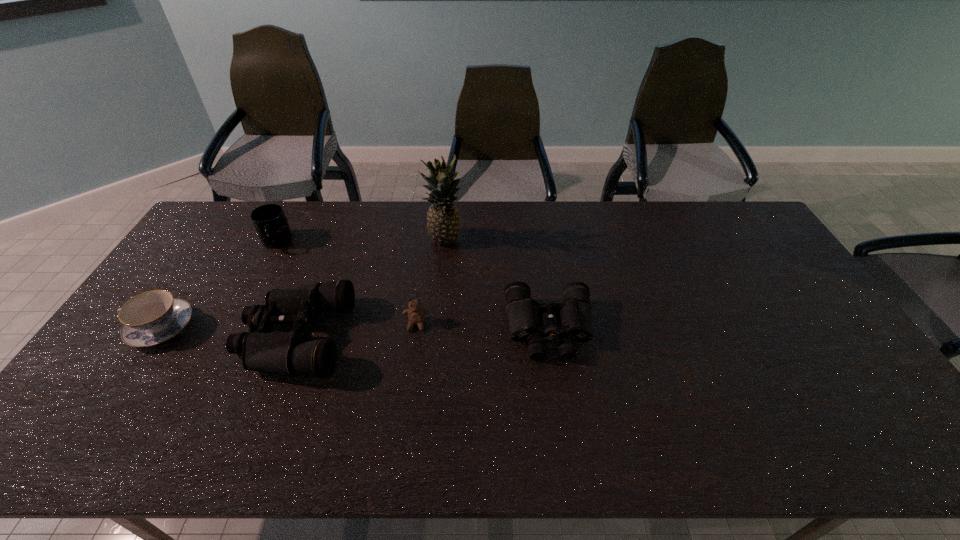
I want to click on vacant space located through the eyepieces of the right binoculars, so [x=562, y=411].

In order to click on free region located with the handle on the side of the mug in this screenshot , I will do `click(253, 285)`.

The image size is (960, 540). What are the coordinates of `free space located 0.130m on the back of the tallest object` in the screenshot? It's located at (448, 208).

Where is `vacant space located on the front-facing side of the teddy bear`? vacant space located on the front-facing side of the teddy bear is located at coordinates (408, 392).

This screenshot has height=540, width=960. Find the location of `mug at the far edge`. mug at the far edge is located at coordinates (270, 222).

Where is `pineapple that is at the far edge`? The width and height of the screenshot is (960, 540). pineapple that is at the far edge is located at coordinates (443, 225).

Where is `object located in the near edge section of the desktop`? The height and width of the screenshot is (540, 960). object located in the near edge section of the desktop is located at coordinates (292, 353).

At what (x,y) coordinates should I click in order to perform the action: click on object located in the left edge section of the desktop. Please return your answer as a coordinate pair (x, y). The image size is (960, 540). Looking at the image, I should click on (152, 317).

I want to click on free location at the far edge, so click(x=340, y=212).

In the image, there is a desktop. Where is `free space at the near edge`? free space at the near edge is located at coordinates [x=206, y=385].